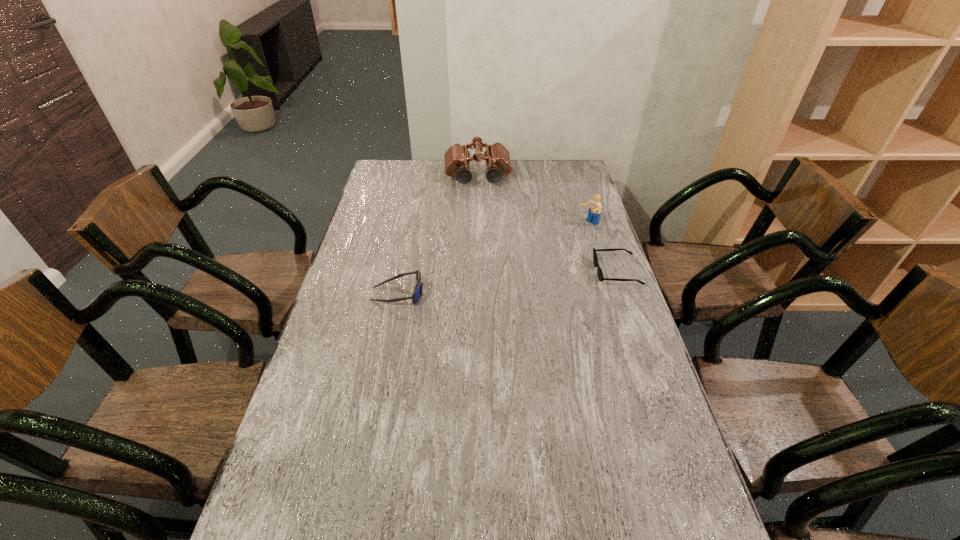
Locate an element on the screen. vacant space on the desktop that is between the third tallest object and the shorter sunglasses and is positioned through the eyepieces of the tallest object is located at coordinates (487, 285).

You are a GUI agent. You are given a task and a screenshot of the screen. Output one action in this format:
    pyautogui.click(x=<x>, y=<y>)
    Task: Click on the free space on the desktop that is between the left sunglasses and the shortest object and is positioned on the face of the third nearest object
    This screenshot has height=540, width=960.
    Given the screenshot: What is the action you would take?
    pyautogui.click(x=483, y=285)